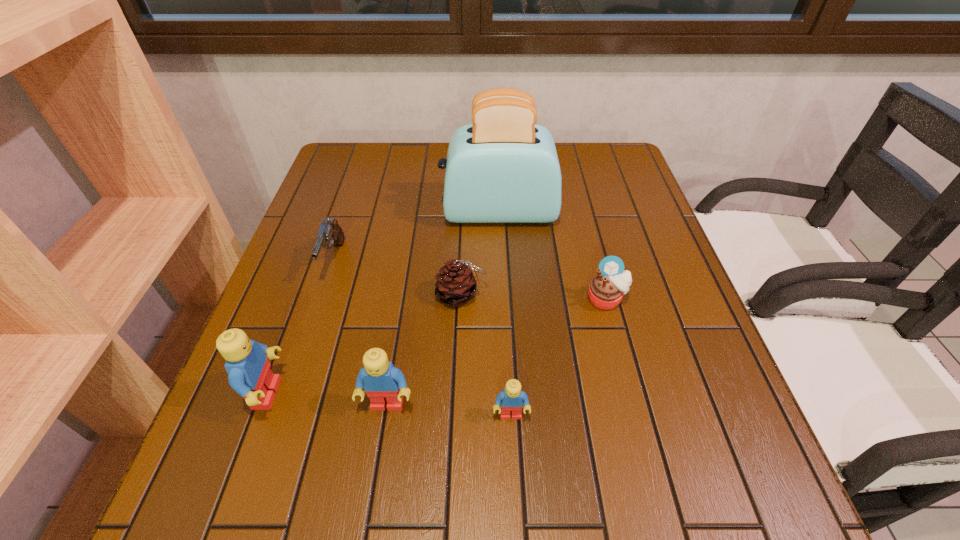
This screenshot has width=960, height=540. I want to click on the leftmost Lego, so click(x=249, y=374).

The height and width of the screenshot is (540, 960). In order to click on the second shortest Lego in this screenshot , I will do `click(382, 382)`.

What are the coordinates of `the fifth shortest object` in the screenshot? It's located at (382, 382).

Locate an element on the screen. The image size is (960, 540). the rightmost Lego is located at coordinates (511, 399).

The image size is (960, 540). What are the coordinates of `toaster` in the screenshot? It's located at (503, 168).

At what (x,y) coordinates should I click in order to perform the action: click on the tallest object. Please return your answer as a coordinate pair (x, y). Image resolution: width=960 pixels, height=540 pixels. Looking at the image, I should click on (503, 168).

The width and height of the screenshot is (960, 540). I want to click on pinecone, so click(x=455, y=285).

Where is `muffin`? muffin is located at coordinates (606, 290).

Identify the location of pistol. (330, 234).

You are a GUI agent. You are given a task and a screenshot of the screen. Output one action in this format:
    pyautogui.click(x=<x>, y=<y>)
    Task: Click on the vacant space positioned 0.340m on the face of the leftmost Lego
    This screenshot has width=960, height=540.
    Given the screenshot: What is the action you would take?
    pyautogui.click(x=470, y=394)